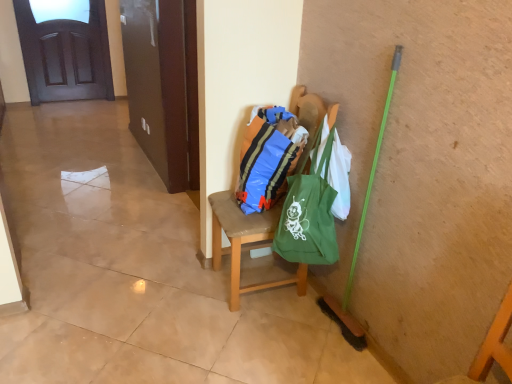
At what (x,y) coordinates should I click in order to perform the action: click on vacant space underneath green canvas tote at center (from a real-world perspective). Please return your answer as a coordinate pair (x, y). The image size is (512, 384). Looking at the image, I should click on (306, 312).